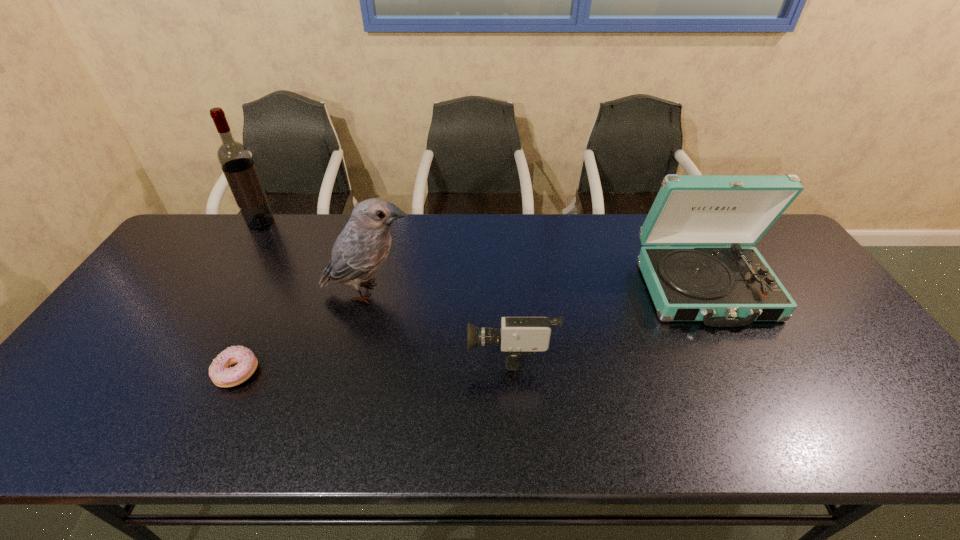
Identify the location of vacant area that lies between the doughnut and the leftmost object. Image resolution: width=960 pixels, height=540 pixels. (250, 298).

I want to click on object that is the fourth closest one to the third object from right to left, so click(732, 286).

Identify which object is the second nearest to the wine bottle. Please provide its 2D coordinates. Your answer should be formatted as a tuple, i.e. [(x, y)], where the tuple contains the x and y coordinates of a point satisfying the conditions above.

[(221, 371)]

At what (x,y) coordinates should I click in order to perform the action: click on vacant space that satisfies the following two spatial constraints: 1. on the face side of the record player; 2. on the front-facing side of the third object from right to left. Please return your answer as a coordinate pair (x, y). The height and width of the screenshot is (540, 960). Looking at the image, I should click on (707, 292).

At what (x,y) coordinates should I click in order to perform the action: click on free space that satisfies the following two spatial constraints: 1. on the recording direction of the fourth tallest object; 2. on the front side of the doughnut. Please return your answer as a coordinate pair (x, y). The height and width of the screenshot is (540, 960). Looking at the image, I should click on (512, 373).